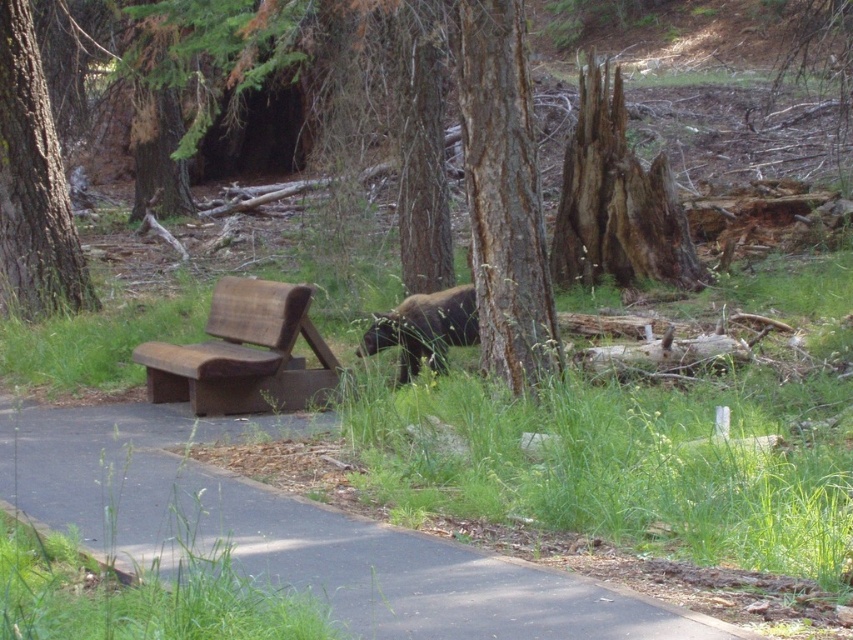
You are a hiker who wants to sit on the brown wooden bench at left while keeping an eye on the brown furry bear at center. Can you do this without leaving the path?

The brown wooden bench at left is positioned on the left side of brown furry bear at center. Since the bench is on the path and to the left of the bear, you can sit there and still see the bear as long as the path allows visibility towards the center.

You are a hiker standing on the black asphalt pavement at lower left and want to reach the rough bark tree at center. Which direction should you move to get closer to the tree?

You should move towards the center of the image because the black asphalt pavement at lower left is in front of the rough bark tree at center, meaning the tree is behind the pavement from your current position.

You are standing at the wooden bench with a simple design near the edge of the path and want to walk to the point marked by the coordinates. Which point, point (601, 596) or point (13, 68), is closer to you?

Point (601, 596) is closer to the viewer than point (13, 68), so the point (601, 596) is closer to you.